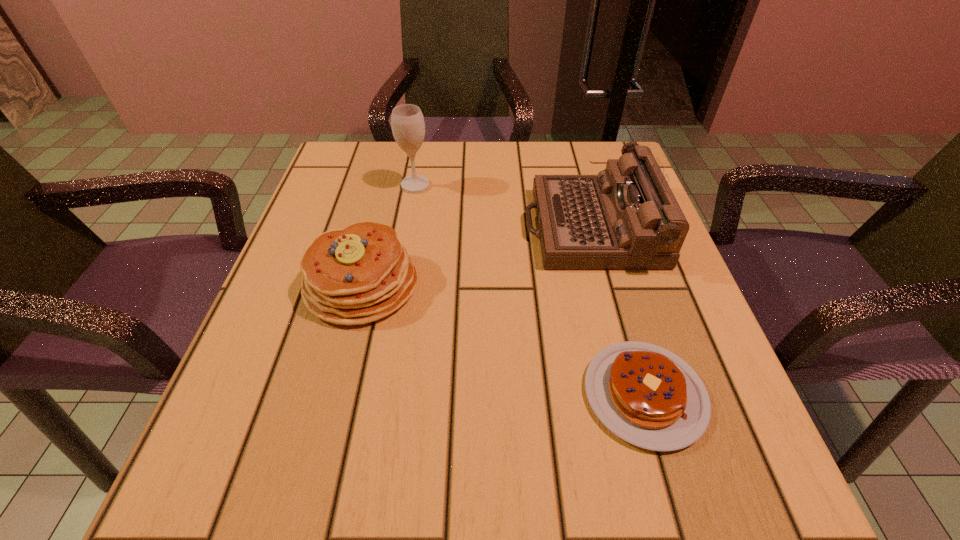
The width and height of the screenshot is (960, 540). I want to click on the tallest object, so click(408, 127).

Image resolution: width=960 pixels, height=540 pixels. In order to click on the third shortest object in this screenshot , I will do `click(625, 218)`.

At what (x,y) coordinates should I click in order to perform the action: click on the farther pancake. Please return your answer as a coordinate pair (x, y). This screenshot has height=540, width=960. Looking at the image, I should click on (359, 274).

At what (x,y) coordinates should I click in order to perform the action: click on the third tallest object. Please return your answer as a coordinate pair (x, y). This screenshot has width=960, height=540. Looking at the image, I should click on (359, 274).

Locate an element on the screen. the shorter pancake is located at coordinates (648, 396).

Find the location of `the shortest object`. the shortest object is located at coordinates (648, 396).

Where is `free space located 0.370m on the right of the tallest object`? free space located 0.370m on the right of the tallest object is located at coordinates (591, 185).

Identify the location of free spot located on the keyboard of the typewriter. (428, 227).

In order to click on free space located on the keyboard of the typewriter in this screenshot , I will do `click(399, 227)`.

This screenshot has height=540, width=960. In order to click on vacant space located 0.300m on the keyboard of the typewriter in this screenshot , I will do `click(380, 227)`.